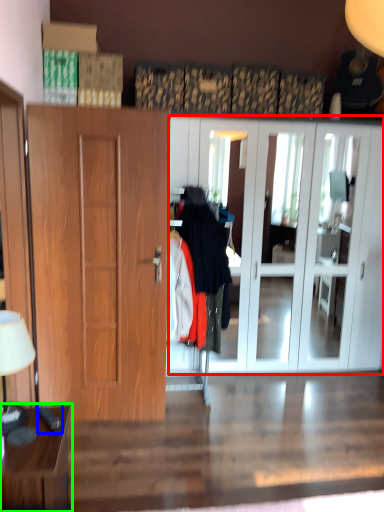
Question: Which is nearer to the cabinetry (highlighted by a red box)? remote control (highlighted by a blue box) or table (highlighted by a green box).

Choices:
 (A) remote control
 (B) table

Answer: (B)